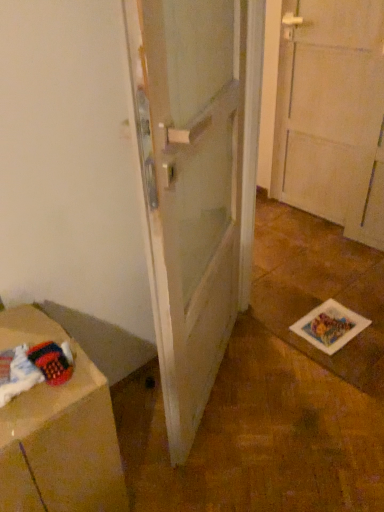
Question: Is white matte door at center further to camera compared to brown cardboard at lower left?

Choices:
 (A) yes
 (B) no

Answer: (B)

Question: From a real-world perspective, does white matte door at center sit lower than brown cardboard at lower left?

Choices:
 (A) yes
 (B) no

Answer: (B)

Question: From the image's perspective, is white matte door at center over brown cardboard at lower left?

Choices:
 (A) no
 (B) yes

Answer: (B)

Question: Is white matte door at center outside brown cardboard at lower left?

Choices:
 (A) no
 (B) yes

Answer: (B)

Question: Can you confirm if white matte door at center is shorter than brown cardboard at lower left?

Choices:
 (A) yes
 (B) no

Answer: (B)

Question: Considering the relative sizes of white matte door at center and brown cardboard at lower left in the image provided, is white matte door at center smaller than brown cardboard at lower left?

Choices:
 (A) no
 (B) yes

Answer: (A)

Question: Is brown cardboard at lower left wider than white matte door at center?

Choices:
 (A) yes
 (B) no

Answer: (A)

Question: From the image's perspective, is brown cardboard at lower left beneath white matte door at center?

Choices:
 (A) yes
 (B) no

Answer: (A)

Question: From the image's perspective, would you say brown cardboard at lower left is positioned over white matte door at center?

Choices:
 (A) no
 (B) yes

Answer: (A)

Question: Is brown cardboard at lower left aimed at white matte door at center?

Choices:
 (A) yes
 (B) no

Answer: (B)

Question: Does brown cardboard at lower left have a smaller size compared to white matte door at center?

Choices:
 (A) yes
 (B) no

Answer: (A)

Question: Is brown cardboard at lower left further to the viewer compared to white matte door at center?

Choices:
 (A) no
 (B) yes

Answer: (B)

Question: Based on their positions, is white matte door at center located to the left or right of brown cardboard at lower left?

Choices:
 (A) left
 (B) right

Answer: (B)